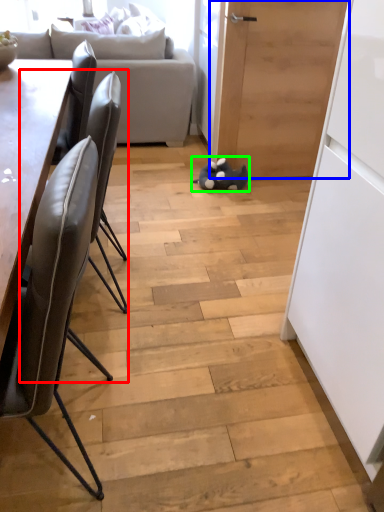
Question: Considering the real-world distances, which object is farthest from chair (highlighted by a red box)? door (highlighted by a blue box) or toy (highlighted by a green box)?

Choices:
 (A) door
 (B) toy

Answer: (A)